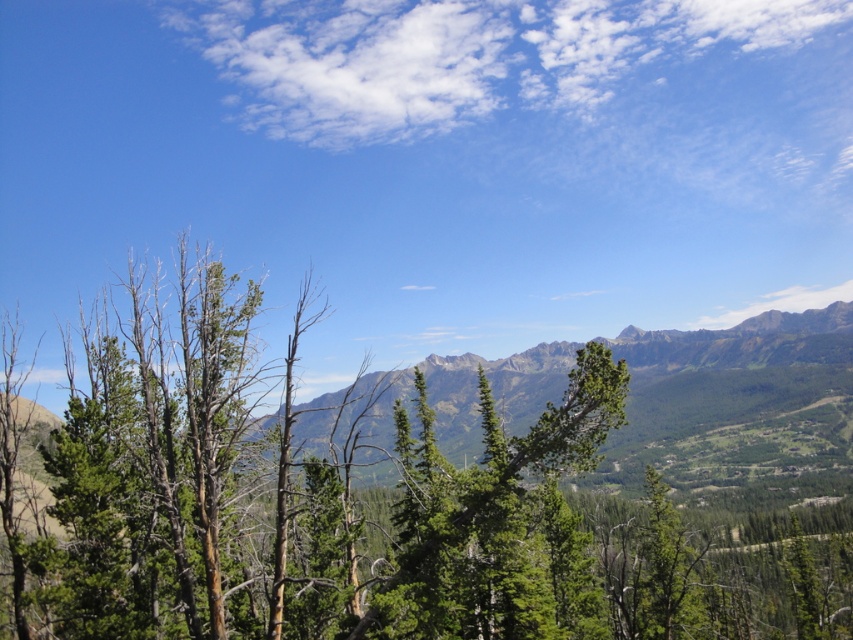
Which is above, green textured tree at center or green textured mountain range at center?

green textured tree at center is above.

Is point (558, 618) less distant than point (801, 465)?

Yes, point (558, 618) is closer to viewer.

Between point (740, 621) and point (833, 429), which one is positioned in front?

Point (740, 621)

Find the location of a particular element. This screenshot has width=853, height=640. green textured tree at center is located at coordinates (418, 481).